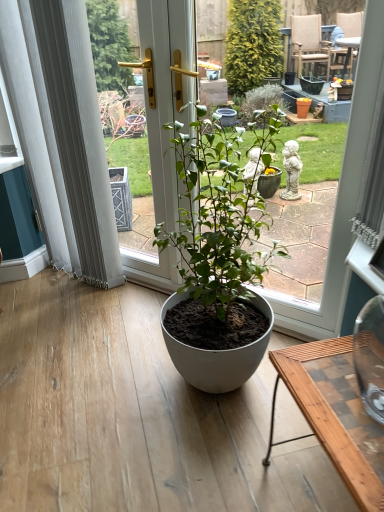
This screenshot has height=512, width=384. Describe the element at coordinates (340, 201) in the screenshot. I see `matte white pot at center` at that location.

This screenshot has width=384, height=512. What do you see at coordinates (327, 418) in the screenshot?
I see `wooden desk at lower right` at bounding box center [327, 418].

This screenshot has width=384, height=512. What are the coordinates of `matte white pot at center` in the screenshot? It's located at (216, 264).

Find the location of a particular element. The height and width of the screenshot is (512, 384). matte white pot at center is located at coordinates (340, 201).

Is matte white pot at center in front of or behind wooden desk at lower right in the image?

matte white pot at center is positioned farther from the viewer than wooden desk at lower right.

Could you tell me if matte white pot at center is facing wooden desk at lower right?

No, matte white pot at center is not facing towards wooden desk at lower right.

You are a GUI agent. You are given a task and a screenshot of the screen. Output one action in this format:
    pyautogui.click(x=<x>, y=<y>)
    Task: Click on the desk on the right of matte white pot at center
    
    Given the screenshot: What is the action you would take?
    (327, 418)

From the image's perspective, which is above, matte white pot at center or wooden desk at lower right?

matte white pot at center is shown above in the image.

In the scene shown: What's the angular difference between matte white pot at center and matte white pot at center's facing directions?

The angle between the facing direction of matte white pot at center and the facing direction of matte white pot at center is 3.46 degrees.

In the scene shown: Between matte white pot at center and matte white pot at center, which one has larger size?

matte white pot at center is bigger.

Is matte white pot at center a part of matte white pot at center?

No, matte white pot at center is located outside of matte white pot at center.

Considering the relative sizes of white sheer curtain at left and matte white pot at center in the image provided, is white sheer curtain at left shorter than matte white pot at center?

In fact, white sheer curtain at left may be taller than matte white pot at center.

Is white sheer curtain at left positioned before matte white pot at center?

No, it is not.

From the image's perspective, which is above, white sheer curtain at left or matte white pot at center?

white sheer curtain at left.

Locate an element on the screen. The image size is (384, 512). curtain located on the left of matte white pot at center is located at coordinates (79, 135).

Is matte white pot at center looking in the opposite direction of white sheer curtain at left?

That's not correct — matte white pot at center is not looking away from white sheer curtain at left.

Does matte white pot at center lie behind white sheer curtain at left?

No, matte white pot at center is closer to the camera.

From a real-world perspective, is matte white pot at center below white sheer curtain at left?

Yes, from a real-world perspective, matte white pot at center is under white sheer curtain at left.

Is white sheer curtain at left not near wooden desk at lower right?

Yes, white sheer curtain at left and wooden desk at lower right are quite far apart.

Locate an element on the screen. This screenshot has height=512, width=384. curtain above the wooden desk at lower right (from the image's perspective) is located at coordinates (79, 135).

Can you confirm if white sheer curtain at left is taller than wooden desk at lower right?

Indeed, white sheer curtain at left has a greater height compared to wooden desk at lower right.

From the image's perspective, is wooden desk at lower right located above or below white sheer curtain at left?

wooden desk at lower right is situated lower than white sheer curtain at left in the image.

Is wooden desk at lower right not within white sheer curtain at left?

Absolutely, wooden desk at lower right is external to white sheer curtain at left.

Can you confirm if wooden desk at lower right is taller than white sheer curtain at left?

Incorrect, the height of wooden desk at lower right is not larger of that of white sheer curtain at left.

Who is more distant, wooden desk at lower right or white sheer curtain at left?

white sheer curtain at left is further from the camera.

Does point (257, 211) lie in front of point (74, 122)?

That is False.

How many degrees apart are the facing directions of matte white pot at center and white sheer curtain at left?

The angular difference between matte white pot at center and white sheer curtain at left is 3.46 degrees.

In the scene shown: Considering the relative sizes of matte white pot at center and white sheer curtain at left in the image provided, is matte white pot at center bigger than white sheer curtain at left?

Yes, matte white pot at center is bigger than white sheer curtain at left.

Consider the image. Is matte white pot at center inside the boundaries of white sheer curtain at left, or outside?

matte white pot at center lies outside white sheer curtain at left.

Where is `houseplant located behind the wooden desk at lower right`? houseplant located behind the wooden desk at lower right is located at coordinates (216, 264).

Find the location of a particular element. This screenshot has width=384, height=512. houseplant lying on the left of matte white pot at center is located at coordinates (216, 264).

From the image, which object appears to be nearer to matte white pot at center, wooden desk at lower right or white sheer curtain at left?

The object closer to matte white pot at center is wooden desk at lower right.

Based on their spatial positions, is white sheer curtain at left or matte white pot at center further from wooden desk at lower right?

Among the two, white sheer curtain at left is located further to wooden desk at lower right.

When comparing their distances from wooden desk at lower right, does white sheer curtain at left or matte white pot at center seem closer?

matte white pot at center.

From the image, which object appears to be farther from matte white pot at center, white sheer curtain at left or wooden desk at lower right?

The object further to matte white pot at center is white sheer curtain at left.

Estimate the real-world distances between objects in this image. Which object is closer to white sheer curtain at left, matte white pot at center or matte white pot at center?

Among the two, matte white pot at center is located nearer to white sheer curtain at left.

Considering their positions, is wooden desk at lower right positioned closer to matte white pot at center than white sheer curtain at left?

wooden desk at lower right lies closer to matte white pot at center than the other object.

Consider the image. From the image, which object appears to be farther from matte white pot at center, matte white pot at center or white sheer curtain at left?

The object further to matte white pot at center is white sheer curtain at left.

Considering their positions, is white sheer curtain at left positioned closer to matte white pot at center than wooden desk at lower right?

wooden desk at lower right.

I want to click on bay window between white sheer curtain at left and wooden desk at lower right from top to bottom, so click(340, 201).

Identify the location of houseplant between matte white pot at center and wooden desk at lower right in the up-down direction. (216, 264).

Locate an element on the screen. The image size is (384, 512). houseplant between white sheer curtain at left and matte white pot at center is located at coordinates (216, 264).

Identify the location of houseplant between white sheer curtain at left and wooden desk at lower right from top to bottom. (216, 264).